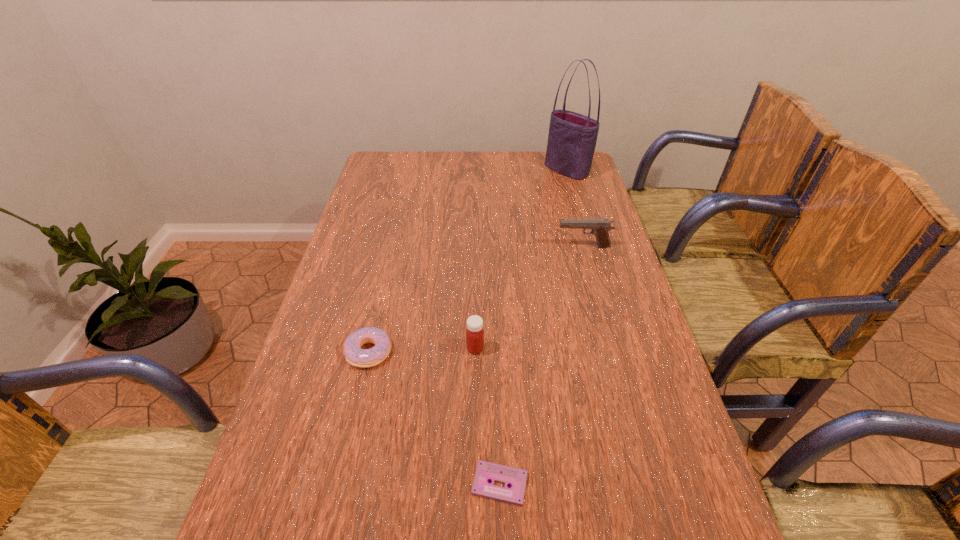
The width and height of the screenshot is (960, 540). Identify the location of unoccupied area between the medicine and the tallest object. (521, 259).

You are a GUI agent. You are given a task and a screenshot of the screen. Output one action in this format:
    pyautogui.click(x=<x>, y=<y>)
    Task: Click on the free spot between the second shortest object and the medicine
    
    Given the screenshot: What is the action you would take?
    pyautogui.click(x=422, y=350)

Identify the location of vacant point located between the videotape and the tallest object. The width and height of the screenshot is (960, 540). (533, 327).

Where is `object that is the third closest to the farthest object`? Image resolution: width=960 pixels, height=540 pixels. object that is the third closest to the farthest object is located at coordinates (356, 356).

The width and height of the screenshot is (960, 540). I want to click on the third closest object to the farthest object, so click(x=356, y=356).

You are a GUI agent. You are given a task and a screenshot of the screen. Output one action in this format:
    pyautogui.click(x=<x>, y=<y>)
    Task: Click on the blank space that satisfies the following two spatial constraints: 1. on the front side of the shortest object; 2. on the left side of the leftmost object
    
    Given the screenshot: What is the action you would take?
    pyautogui.click(x=339, y=483)

The height and width of the screenshot is (540, 960). Identify the location of free space in the image that satisfies the following two spatial constraints: 1. at the barrel of the fourth nearest object; 2. on the front side of the doughnut. (612, 352).

Locate an element on the screen. vacant space that satisfies the following two spatial constraints: 1. on the back side of the medicine; 2. on the right side of the leftmost object is located at coordinates (370, 348).

Where is `free location that satisfies the following two spatial constraints: 1. at the barrel of the pistol; 2. on the front side of the second shortest object`? The height and width of the screenshot is (540, 960). free location that satisfies the following two spatial constraints: 1. at the barrel of the pistol; 2. on the front side of the second shortest object is located at coordinates (612, 352).

Identify the location of free space that satisfies the following two spatial constraints: 1. on the front side of the medicine; 2. on the left side of the nearest object. The height and width of the screenshot is (540, 960). [x=474, y=483].